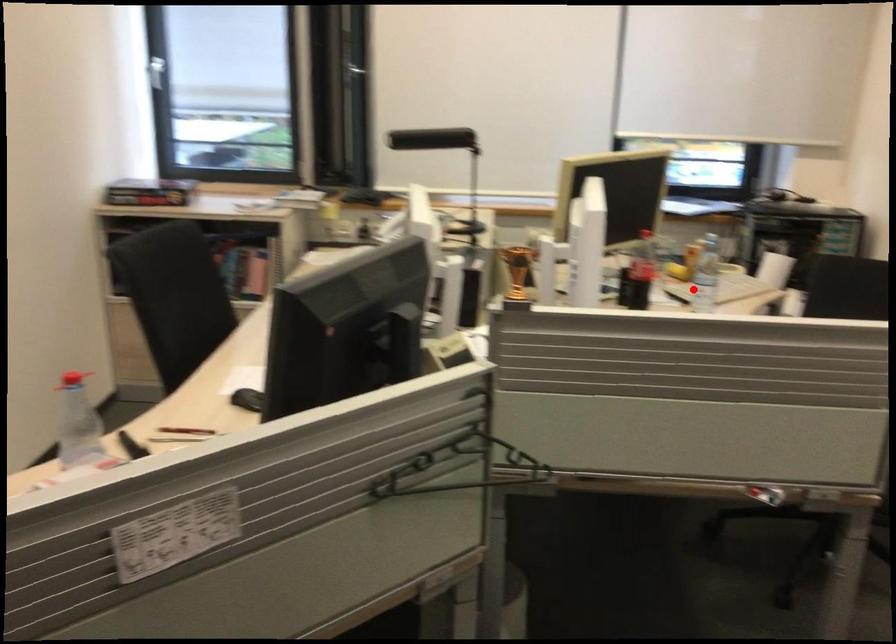
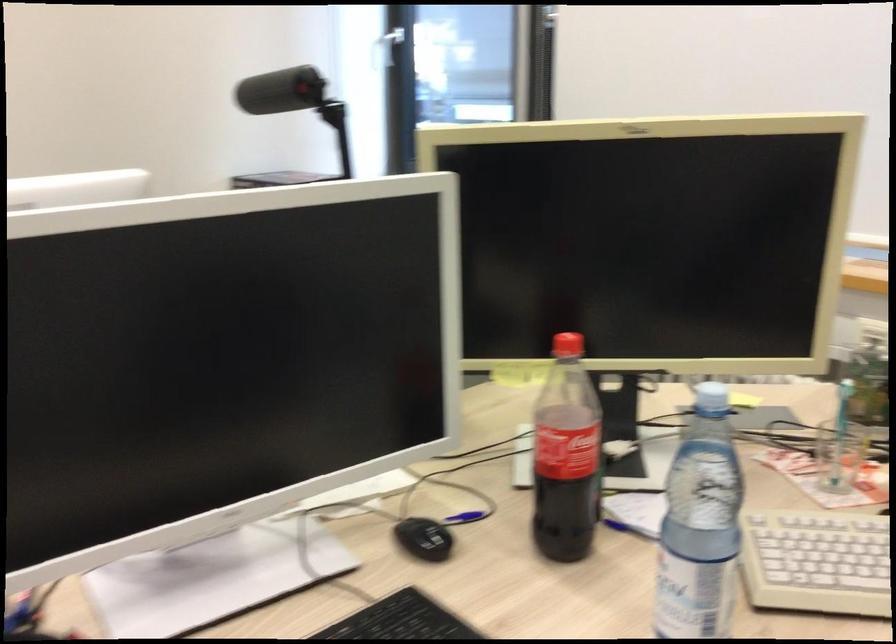
Locate, in the second image, the point that corresponds to the highlighted location in the first image.

(815, 562)